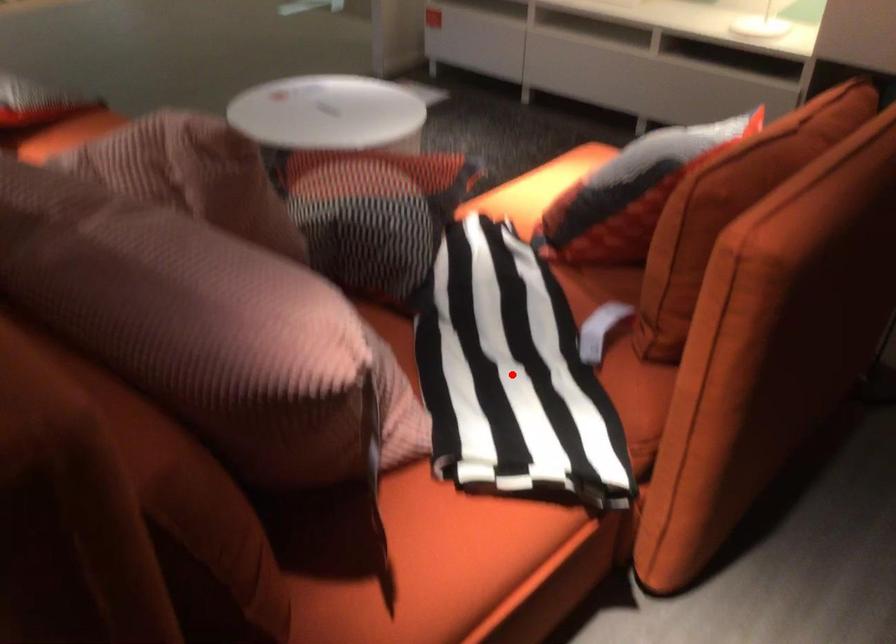
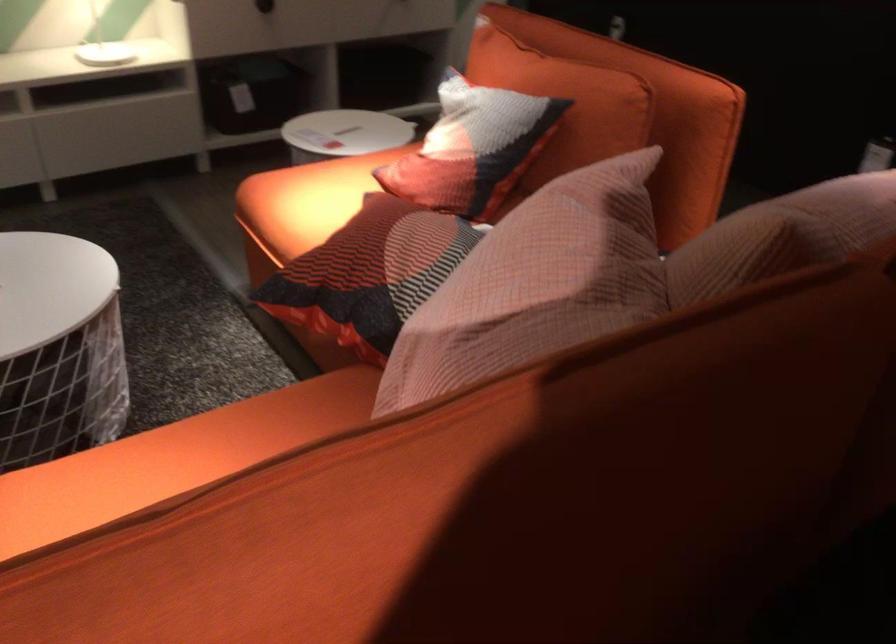
Question: I am providing you with two images of the same scene from different viewpoints. A red point is marked on the first image. At the location where the point appears in image 1, is it still visible in image 2?

Choices:
 (A) Yes
 (B) No

Answer: (B)